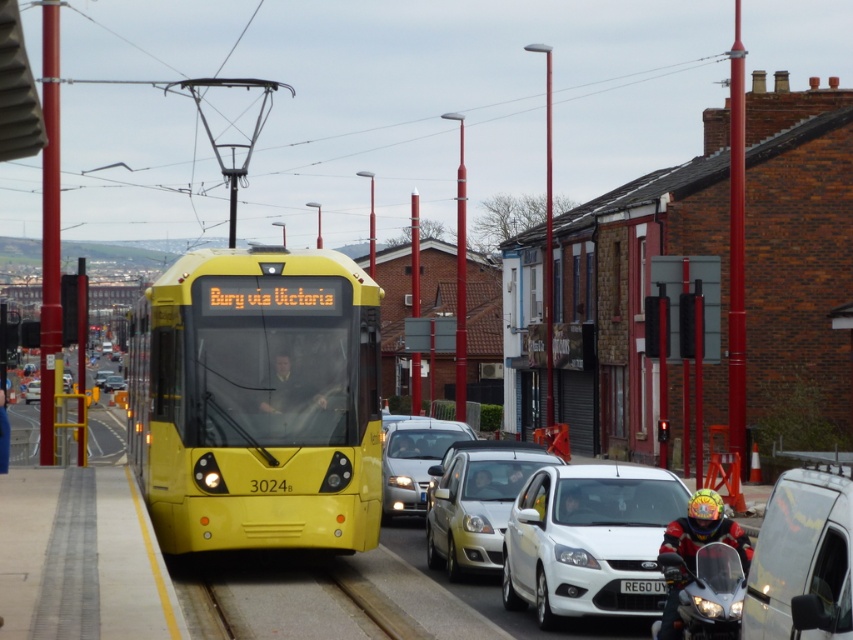
Question: Can you confirm if matte silver sedan at center is wider than red helmeted rider at lower right?

Choices:
 (A) yes
 (B) no

Answer: (A)

Question: Which point is farther to the camera?

Choices:
 (A) (695, 508)
 (B) (471, 461)
 (C) (212, 586)

Answer: (B)

Question: Estimate the real-world distances between objects in this image. Which object is farther from the matte silver sedan at center?

Choices:
 (A) metallic silver car at center
 (B) smooth leather helmet at center
 (C) white glossy van at lower right

Answer: (A)

Question: Is white glossy van at lower right closer to camera compared to dark brown leather jacket at center?

Choices:
 (A) no
 (B) yes

Answer: (B)

Question: Among these objects, which one is nearest to the camera?

Choices:
 (A) dark brown leather jacket at center
 (B) red helmeted rider at lower right

Answer: (B)

Question: Is the position of smooth leather helmet at center less distant than that of white plastic license plate at center?

Choices:
 (A) yes
 (B) no

Answer: (B)